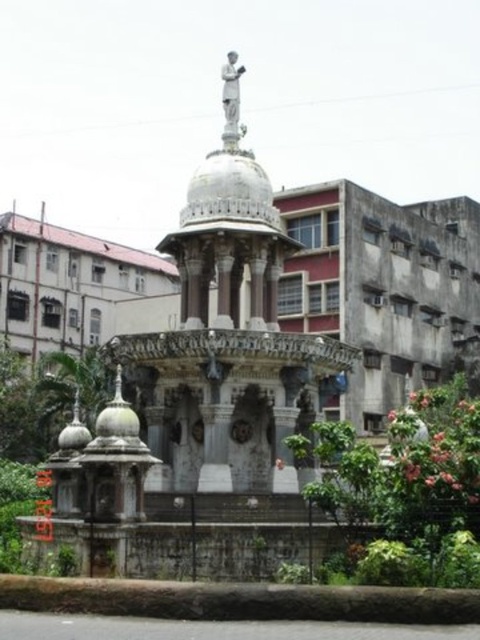
You are a tourist standing at the base of the monument and want to take a photo of both the white marble fountain at center and the white marble statue at upper center. Which object should you position yourself closer to in order to capture both in a single frame?

To capture both the white marble fountain at center and the white marble statue at upper center in a single frame, you should position yourself closer to the white marble statue at upper center since the fountain is to the right of the statue, allowing both to be included in the photo.

You are standing at the camera position and want to take a photo of the white marble fountain at center. Given that your camera has a maximum zoom range of 100 feet, can you capture the fountain without moving closer?

The white marble fountain at center and camera are 138.17 feet apart from each other. Since the camera can only zoom up to 100 feet, you cannot capture the fountain without moving closer.

You are a tourist visiting the monument and want to take a photo of the white marble statue at upper center without the white marble fountain at center blocking the view. Is it possible to position yourself in a way that the statue is visible while the fountain is out of the frame?

The white marble fountain at center is much taller than the white marble statue at upper center, so positioning yourself behind the statue or moving further away might allow you to frame the statue without the fountain obstructing the view.